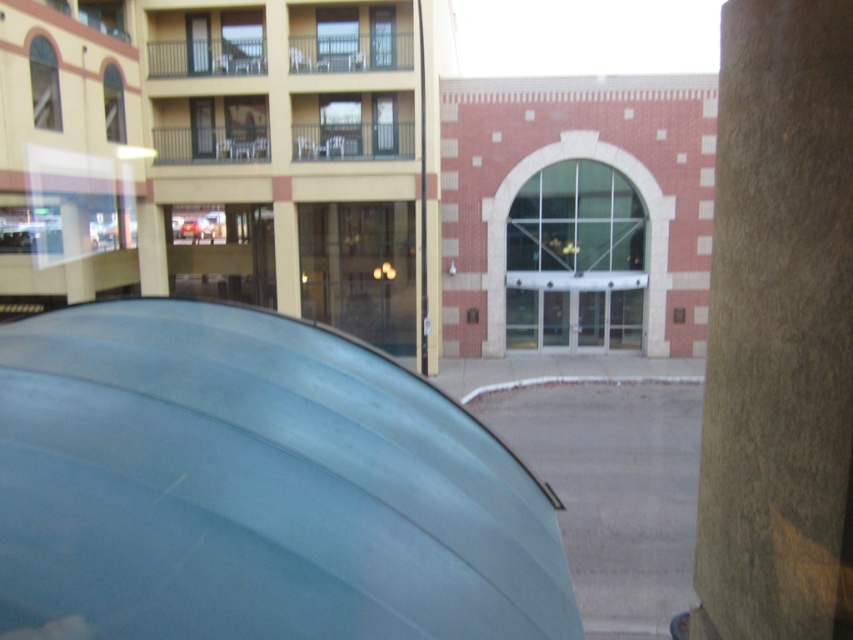
Question: Is brown stone pillar at right smaller than metallic silver car at center?

Choices:
 (A) yes
 (B) no

Answer: (B)

Question: From the image, what is the correct spatial relationship of matte blue car at center in relation to metallic silver car at center?

Choices:
 (A) above
 (B) below

Answer: (B)

Question: Which object appears farthest from the camera in this image?

Choices:
 (A) metallic silver car at center
 (B) brown stone pillar at right
 (C) matte blue car at center

Answer: (A)

Question: Which point appears closest to the camera in this image?

Choices:
 (A) (779, 54)
 (B) (312, 637)

Answer: (A)

Question: Is brown stone pillar at right smaller than metallic silver car at center?

Choices:
 (A) yes
 (B) no

Answer: (B)

Question: Estimate the real-world distances between objects in this image. Which object is farther from the metallic silver car at center?

Choices:
 (A) brown stone pillar at right
 (B) matte blue car at center

Answer: (B)